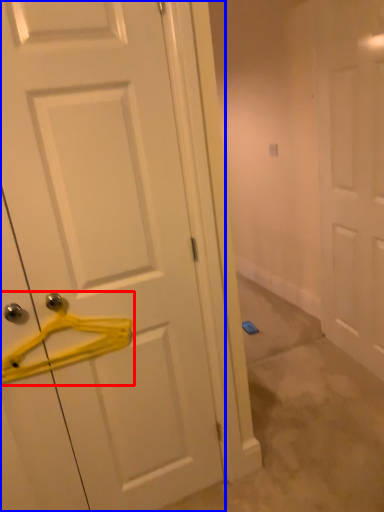
Question: Among these objects, which one is nearest to the camera, hanger (highlighted by a red box) or door (highlighted by a blue box)?

Choices:
 (A) hanger
 (B) door

Answer: (B)